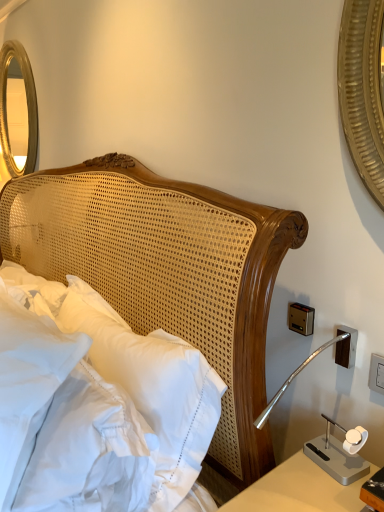
Question: Are white woven headboard at center and white plastic electric outlet at right making contact?

Choices:
 (A) no
 (B) yes

Answer: (A)

Question: Considering the relative sizes of white woven headboard at center and white plastic electric outlet at right in the image provided, is white woven headboard at center wider than white plastic electric outlet at right?

Choices:
 (A) yes
 (B) no

Answer: (A)

Question: From a real-world perspective, is white woven headboard at center below white plastic electric outlet at right?

Choices:
 (A) no
 (B) yes

Answer: (B)

Question: Would you consider white woven headboard at center to be distant from white plastic electric outlet at right?

Choices:
 (A) yes
 (B) no

Answer: (B)

Question: Considering the relative positions of white woven headboard at center and white plastic electric outlet at right in the image provided, is white woven headboard at center to the right of white plastic electric outlet at right from the viewer's perspective?

Choices:
 (A) yes
 (B) no

Answer: (B)

Question: Relative to white plastic electric outlet at right, is white woven headboard at center in front or behind?

Choices:
 (A) front
 (B) behind

Answer: (A)

Question: From a real-world perspective, relative to white plastic electric outlet at right, is white woven headboard at center vertically above or below?

Choices:
 (A) below
 (B) above

Answer: (A)

Question: Considering the positions of white woven headboard at center and white plastic electric outlet at right in the image, is white woven headboard at center wider or thinner than white plastic electric outlet at right?

Choices:
 (A) wide
 (B) thin

Answer: (A)

Question: Does point click(x=264, y=317) appear closer or farther from the camera than point click(x=372, y=361)?

Choices:
 (A) farther
 (B) closer

Answer: (B)

Question: Considering the positions of white plastic electric outlet at right and white soft pillow at left in the image, is white plastic electric outlet at right taller or shorter than white soft pillow at left?

Choices:
 (A) tall
 (B) short

Answer: (B)

Question: Is point (375, 361) closer or farther from the camera than point (3, 449)?

Choices:
 (A) farther
 (B) closer

Answer: (A)

Question: From a real-world perspective, is white plastic electric outlet at right above or below white soft pillow at left?

Choices:
 (A) above
 (B) below

Answer: (A)

Question: Considering the positions of white plastic electric outlet at right and white soft pillow at left in the image, is white plastic electric outlet at right bigger or smaller than white soft pillow at left?

Choices:
 (A) big
 (B) small

Answer: (B)

Question: From a real-world perspective, is gold metallic mirror at upper left positioned above or below white woven headboard at center?

Choices:
 (A) above
 (B) below

Answer: (A)

Question: From the image's perspective, is gold metallic mirror at upper left located above or below white woven headboard at center?

Choices:
 (A) below
 (B) above

Answer: (B)